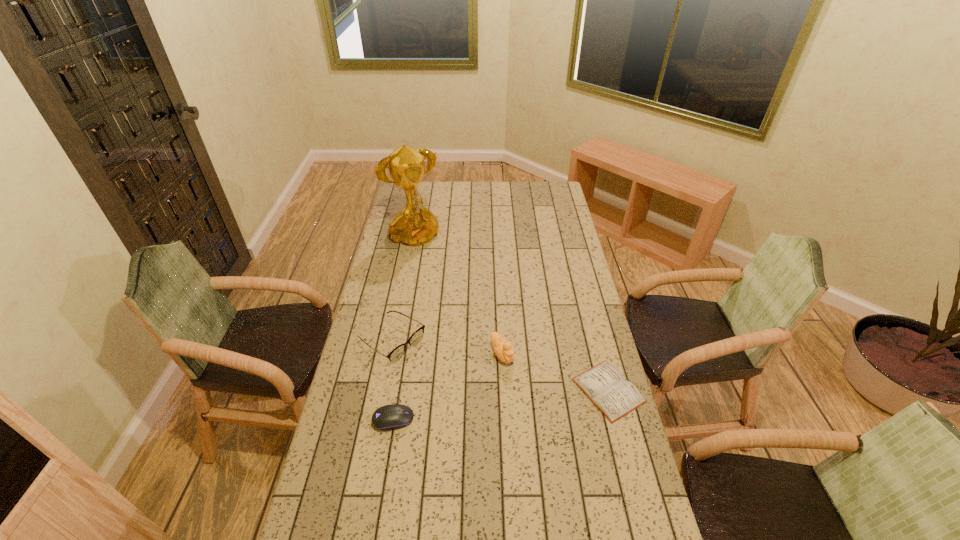
This screenshot has width=960, height=540. I want to click on vacant space on the desktop that is between the second shortest object and the shortest object and is positioned on the face of the spectacles, so click(488, 407).

I want to click on vacant spot on the desktop that is between the second shortest object and the shortest object and is positioned on the face of the fourth object from left to right, so (x=535, y=400).

Locate an element on the screen. free spot on the desktop that is between the computer mouse and the diary and is positioned on the front side of the tallest object is located at coordinates (535, 400).